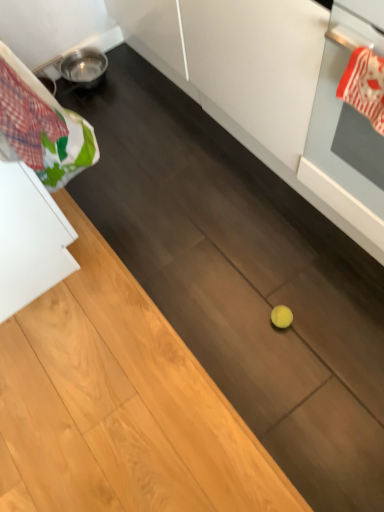
Find the location of a particular element. This screenshot has width=384, height=512. plaid fabric laundry at upper left is located at coordinates (41, 127).

How different are the orientations of red and white striped oven mitt at upper right and plaid fabric laundry at upper left in degrees?

red and white striped oven mitt at upper right and plaid fabric laundry at upper left are facing 1.44 degrees away from each other.

Considering the relative sizes of red and white striped oven mitt at upper right and plaid fabric laundry at upper left in the image provided, is red and white striped oven mitt at upper right thinner than plaid fabric laundry at upper left?

Correct, the width of red and white striped oven mitt at upper right is less than that of plaid fabric laundry at upper left.

From a real-world perspective, is red and white striped oven mitt at upper right over plaid fabric laundry at upper left?

No, from a real-world perspective, red and white striped oven mitt at upper right is not on top of plaid fabric laundry at upper left.

Does red and white striped oven mitt at upper right lie in front of plaid fabric laundry at upper left?

No.

In terms of height, does white glossy oven at right look taller or shorter compared to plaid fabric laundry at upper left?

In the image, white glossy oven at right appears to be taller than plaid fabric laundry at upper left.

How far apart are white glossy oven at right and plaid fabric laundry at upper left?

white glossy oven at right is 28.40 inches away from plaid fabric laundry at upper left.

Is white glossy oven at right not within plaid fabric laundry at upper left?

Yes, white glossy oven at right is not within plaid fabric laundry at upper left.

From the image's perspective, which is below, red and white striped oven mitt at upper right or white glossy oven at right?

red and white striped oven mitt at upper right, from the image's perspective.

Could you tell me if red and white striped oven mitt at upper right is facing white glossy oven at right?

Yes, red and white striped oven mitt at upper right is oriented towards white glossy oven at right.

Which of these two, red and white striped oven mitt at upper right or white glossy oven at right, is smaller?

With smaller size is red and white striped oven mitt at upper right.

Looking at their sizes, would you say white glossy oven at right is wider or thinner than red and white striped oven mitt at upper right?

Clearly, white glossy oven at right has more width compared to red and white striped oven mitt at upper right.

Is red and white striped oven mitt at upper right surrounded by white glossy oven at right?

Absolutely, red and white striped oven mitt at upper right is inside white glossy oven at right.

Is white glossy oven at right at the left side of red and white striped oven mitt at upper right?

Incorrect, white glossy oven at right is not on the left side of red and white striped oven mitt at upper right.

Is plaid fabric laundry at upper left inside the boundaries of red and white striped oven mitt at upper right, or outside?

plaid fabric laundry at upper left is outside red and white striped oven mitt at upper right.

Which of these two, plaid fabric laundry at upper left or red and white striped oven mitt at upper right, stands taller?

With more height is plaid fabric laundry at upper left.

From a real-world perspective, between plaid fabric laundry at upper left and red and white striped oven mitt at upper right, who is vertically lower?

From a 3D spatial view, red and white striped oven mitt at upper right is below.

Considering the positions of objects plaid fabric laundry at upper left and red and white striped oven mitt at upper right in the image provided, who is more to the left, plaid fabric laundry at upper left or red and white striped oven mitt at upper right?

Positioned to the left is plaid fabric laundry at upper left.

What are the coordinates of `oven in front of the plaid fabric laundry at upper left` in the screenshot? It's located at (347, 126).

Which is behind, point (5, 149) or point (345, 190)?

The point (345, 190) is farther.

Does plaid fabric laundry at upper left turn towards white glossy oven at right?

No.

Can white glossy oven at right be found inside plaid fabric laundry at upper left?

No, plaid fabric laundry at upper left does not contain white glossy oven at right.

You are a GUI agent. You are given a task and a screenshot of the screen. Output one action in this format:
    pyautogui.click(x=<x>, y=<y>)
    Task: Click on the material on the right of plaid fabric laundry at upper left
    The image size is (384, 512).
    Given the screenshot: What is the action you would take?
    pyautogui.click(x=364, y=86)

This screenshot has width=384, height=512. In order to click on laundry that appears on the left of white glossy oven at right in this screenshot , I will do `click(41, 127)`.

In the scene shown: Looking at the image, which one is located further to plaid fabric laundry at upper left, white glossy oven at right or red and white striped oven mitt at upper right?

Based on the image, red and white striped oven mitt at upper right appears to be further to plaid fabric laundry at upper left.

Looking at the image, which one is located further to plaid fabric laundry at upper left, red and white striped oven mitt at upper right or white glossy oven at right?

red and white striped oven mitt at upper right.

Looking at the image, which one is located further to white glossy oven at right, plaid fabric laundry at upper left or red and white striped oven mitt at upper right?

The object further to white glossy oven at right is plaid fabric laundry at upper left.

Based on their spatial positions, is plaid fabric laundry at upper left or white glossy oven at right closer to red and white striped oven mitt at upper right?

white glossy oven at right is closer to red and white striped oven mitt at upper right.

When comparing their distances from red and white striped oven mitt at upper right, does white glossy oven at right or plaid fabric laundry at upper left seem closer?

The object closer to red and white striped oven mitt at upper right is white glossy oven at right.

Based on their spatial positions, is red and white striped oven mitt at upper right or plaid fabric laundry at upper left closer to white glossy oven at right?

The object closer to white glossy oven at right is red and white striped oven mitt at upper right.

The width and height of the screenshot is (384, 512). In order to click on material situated between plaid fabric laundry at upper left and white glossy oven at right from left to right in this screenshot , I will do `click(364, 86)`.